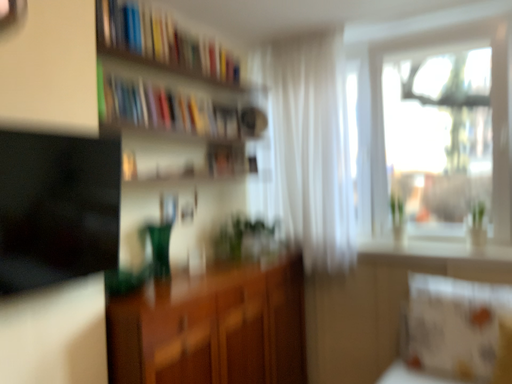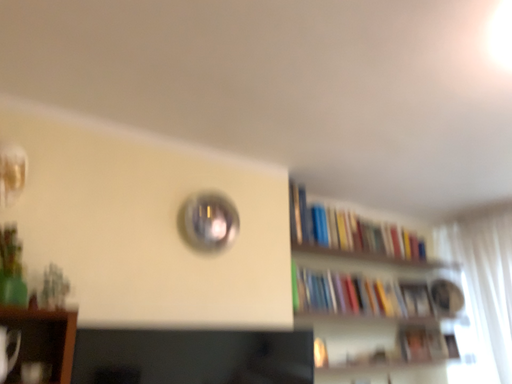
Question: How did the camera likely rotate when shooting the video?

Choices:
 (A) rotated downward
 (B) rotated upward

Answer: (B)